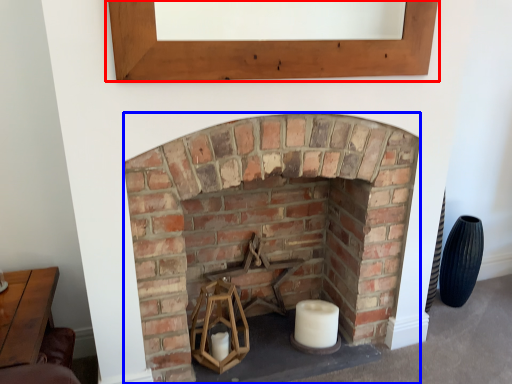
Question: Which object appears farthest to the camera in this image, window frame (highlighted by a red box) or fireplace (highlighted by a blue box)?

Choices:
 (A) window frame
 (B) fireplace

Answer: (B)